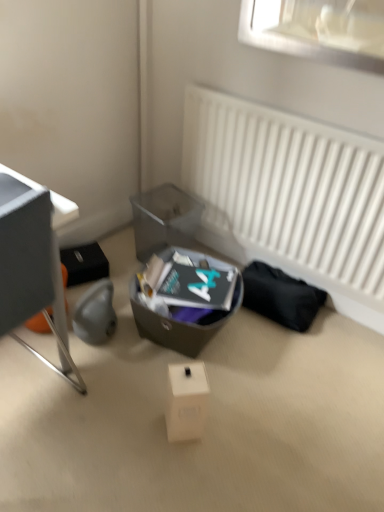
Question: Is point (178, 202) closer or farther from the camera than point (241, 293)?

Choices:
 (A) closer
 (B) farther

Answer: (B)

Question: From a real-world perspective, is translucent plastic shoe box at center physically located above or below matte gray box at center?

Choices:
 (A) below
 (B) above

Answer: (B)

Question: Which object is the farthest from the metallic gray desk at left?

Choices:
 (A) translucent plastic shoe box at center
 (B) matte gray box at center
 (C) white matte cardboard box at center
 (D) white matte radiator at upper right

Answer: (D)

Question: Which object is positioned closest to the white matte cardboard box at center?

Choices:
 (A) metallic gray desk at left
 (B) white matte radiator at upper right
 (C) matte gray box at center
 (D) translucent plastic shoe box at center

Answer: (C)